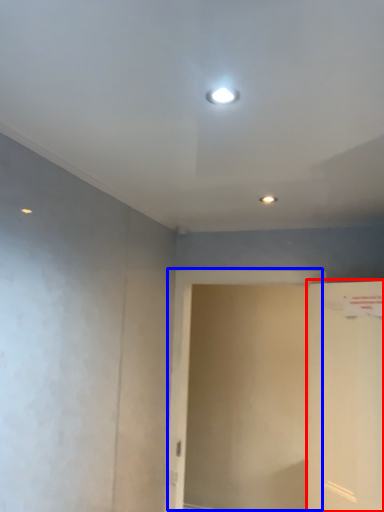
Question: Which object is closer to the camera taking this photo, door (highlighted by a red box) or screen door (highlighted by a blue box)?

Choices:
 (A) door
 (B) screen door

Answer: (A)